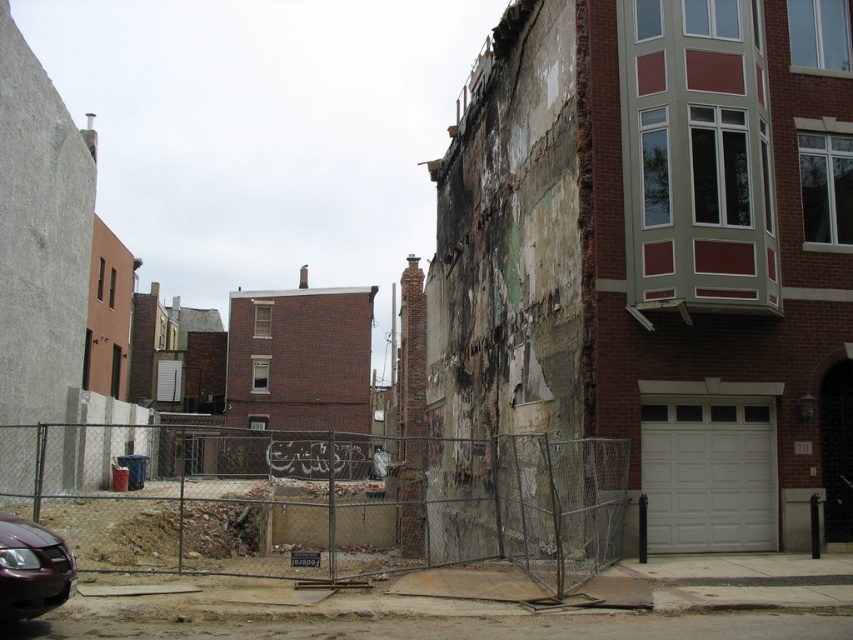
Is the position of metallic chain-link fence at center less distant than that of shiny maroon car at lower left?

No, it is not.

Does point (218, 550) lie behind point (67, 552)?

Yes, point (218, 550) is behind point (67, 552).

Which is behind, point (189, 449) or point (42, 593)?

The point (189, 449) is behind.

Find the location of a particular element. metallic chain-link fence at center is located at coordinates (325, 500).